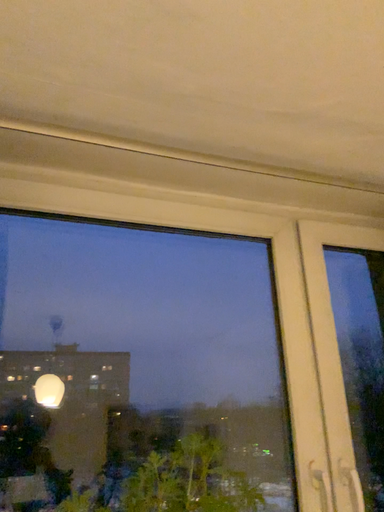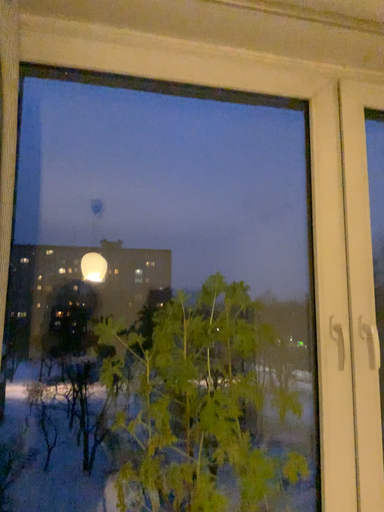
Question: How did the camera likely rotate when shooting the video?

Choices:
 (A) rotated downward
 (B) rotated upward

Answer: (A)